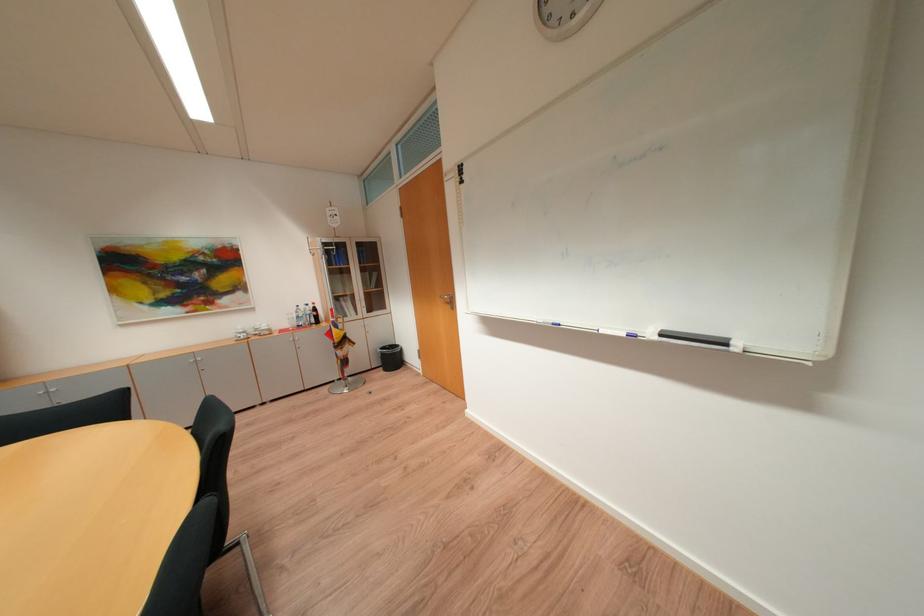
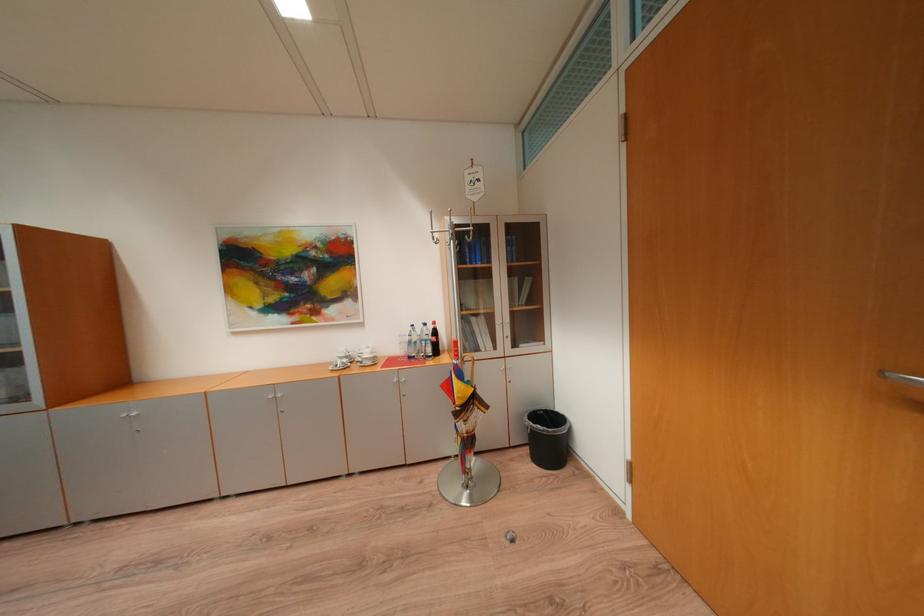
In the second image, find the point that corresponds to point (307, 318) in the first image.

(419, 344)